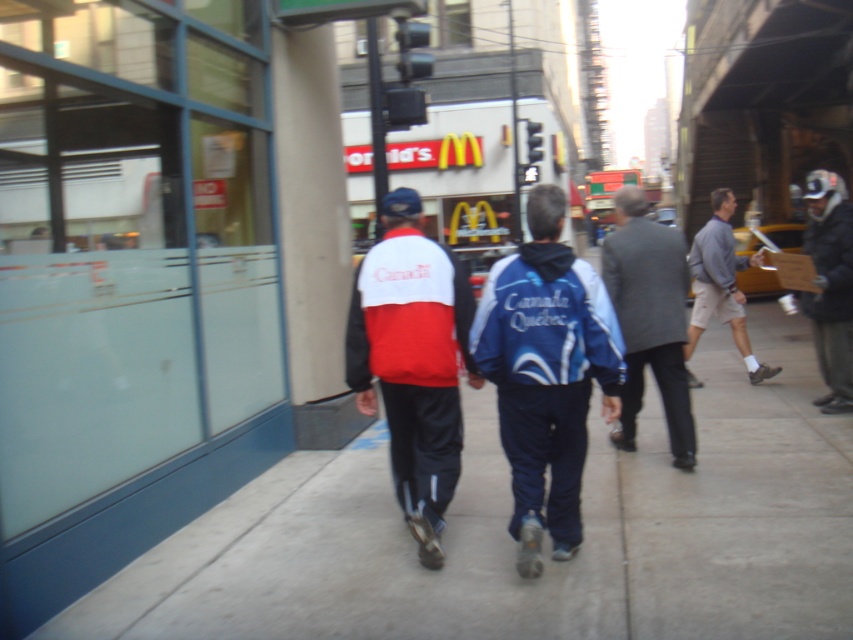
This screenshot has height=640, width=853. Describe the element at coordinates (413, 362) in the screenshot. I see `matte red and white jacket at center` at that location.

In order to click on matte red and white jacket at center in this screenshot , I will do `click(413, 362)`.

Consider the image. Between smooth concrete sidewalk at center and gray wool suit at center, which one is positioned higher?

gray wool suit at center is higher up.

Where is `smooth concrete sidewalk at center`? The image size is (853, 640). smooth concrete sidewalk at center is located at coordinates (514, 541).

Locate an element on the screen. The image size is (853, 640). smooth concrete sidewalk at center is located at coordinates (514, 541).

Is gray wool suit at center below dark gray jacket at right?

Indeed, gray wool suit at center is positioned under dark gray jacket at right.

This screenshot has width=853, height=640. What do you see at coordinates (648, 317) in the screenshot?
I see `gray wool suit at center` at bounding box center [648, 317].

Which is in front, point (668, 339) or point (827, 260)?

Point (668, 339) is more forward.

What are the coordinates of `gray wool suit at center` in the screenshot? It's located at (648, 317).